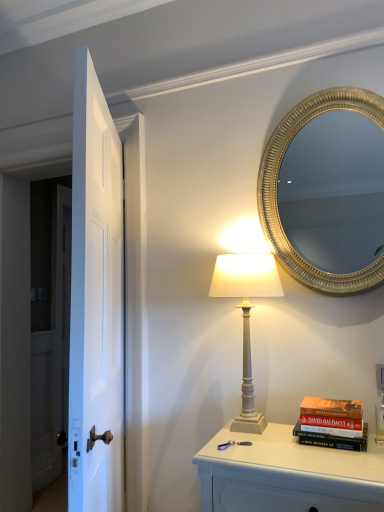
Find the location of `free location in front of white matte table lamp at center`. free location in front of white matte table lamp at center is located at coordinates (279, 454).